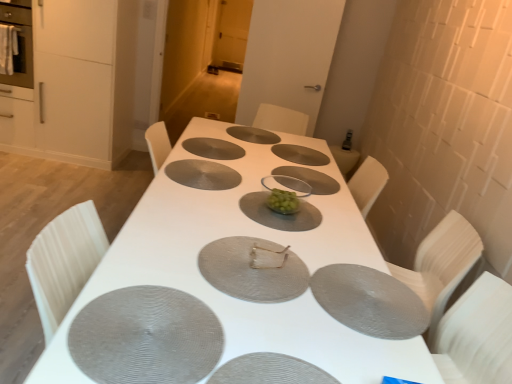
What are the coordinates of `free space in front of gray textured placemat at lower right, which is the third pizza pan from front to back` in the screenshot? It's located at (364, 349).